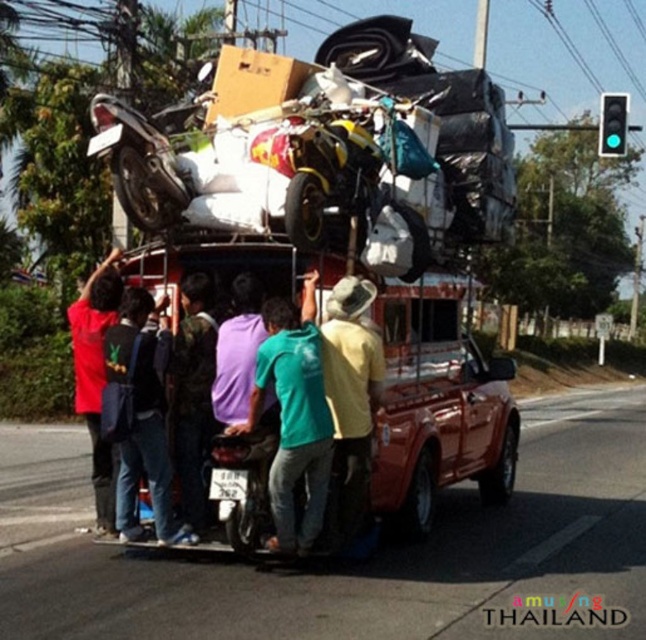
Question: Based on their relative distances, which object is nearer to the camouflage fabric shirt at center?

Choices:
 (A) green cotton shirt at center
 (B) red matte truck at center
 (C) green matte shirt at center
 (D) yellow matte motorcycle at center

Answer: (A)

Question: Can you confirm if green cotton shirt at center is positioned to the left of camouflage fabric shirt at center?

Choices:
 (A) yes
 (B) no

Answer: (B)

Question: Observing the image, what is the correct spatial positioning of green matte shirt at center in reference to camouflage fabric shirt at center?

Choices:
 (A) left
 (B) right

Answer: (B)

Question: Estimate the real-world distances between objects in this image. Which object is closer to the green cotton shirt at center?

Choices:
 (A) green matte shirt at center
 (B) yellow matte motorcycle at center

Answer: (A)

Question: Which object is closer to the camera taking this photo?

Choices:
 (A) green matte shirt at center
 (B) red matte truck at center

Answer: (B)

Question: Does red matte truck at center have a lesser width compared to green matte shirt at center?

Choices:
 (A) yes
 (B) no

Answer: (B)